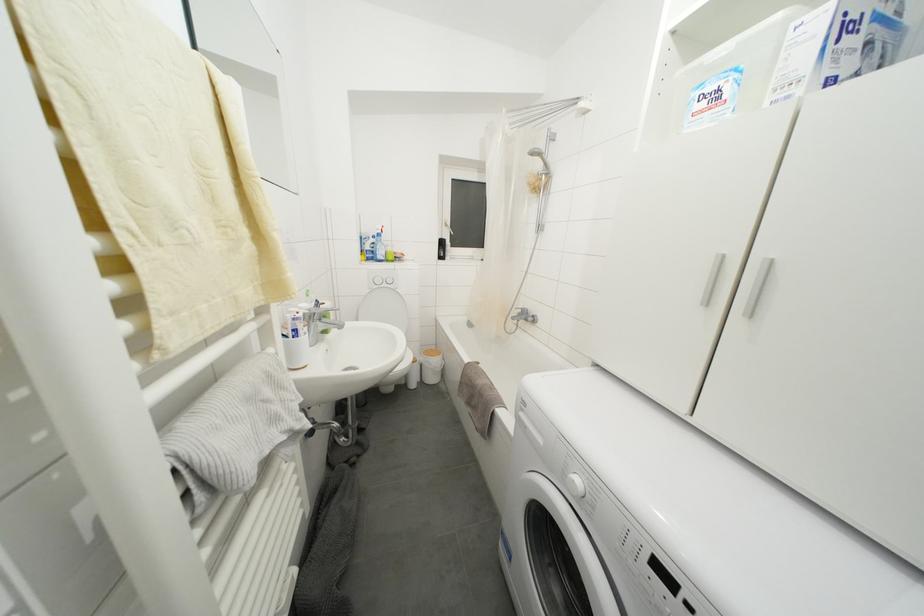
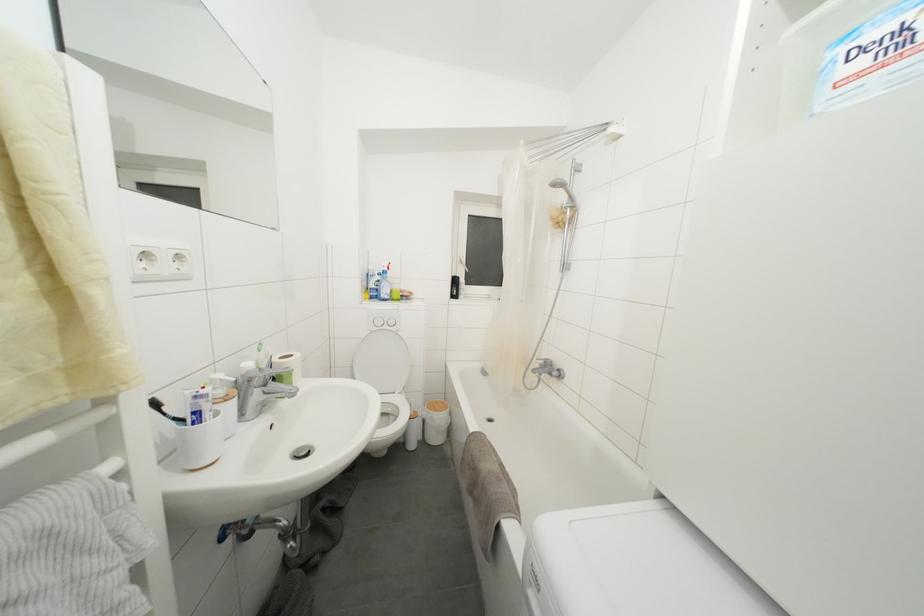
Locate, in the second image, the point that corresponds to (550,168) in the first image.

(575, 200)